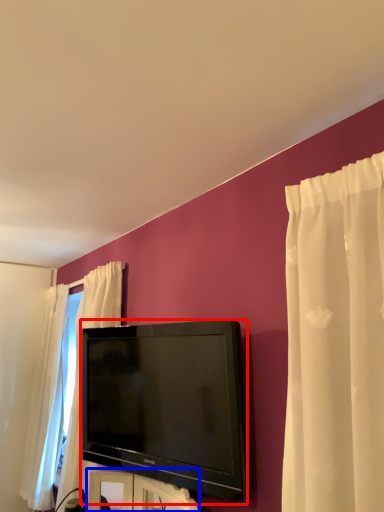
Question: Which object is further to the camera taking this photo, television (highlighted by a red box) or furniture (highlighted by a blue box)?

Choices:
 (A) television
 (B) furniture

Answer: (A)